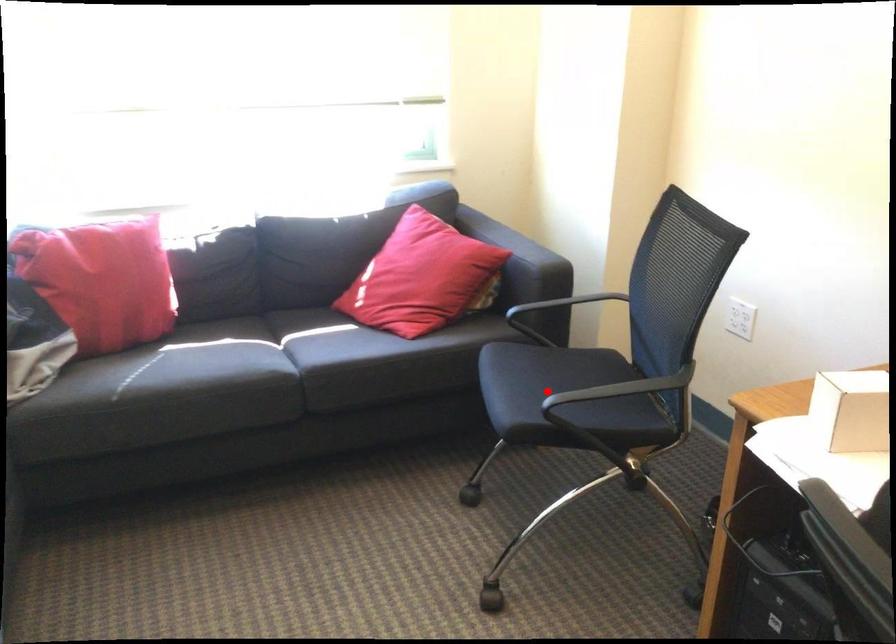
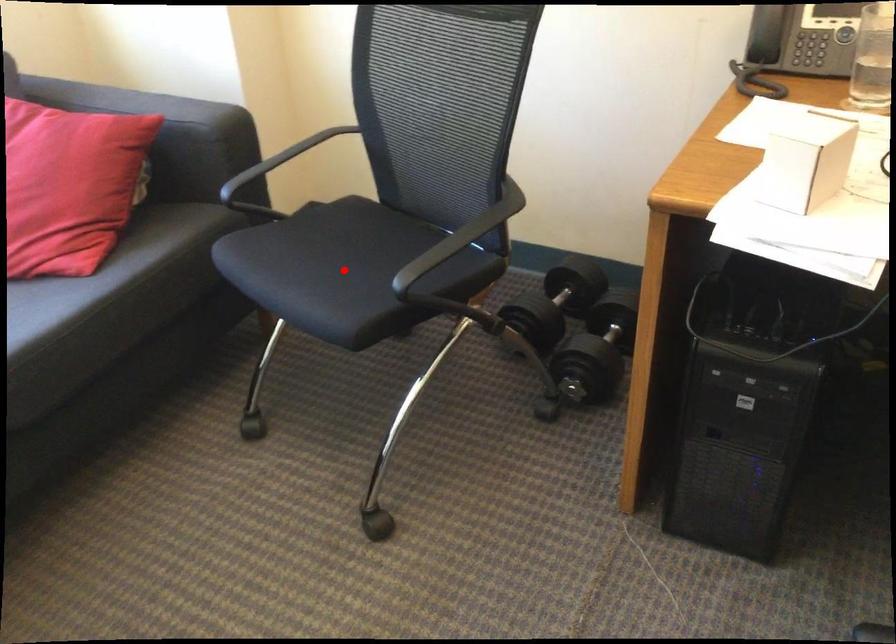
I am providing you with two images of the same scene from different viewpoints. A red point is marked on the first image and another point is marked on the second image. Is the red point in image1 aligned with the point shown in image2?

Yes